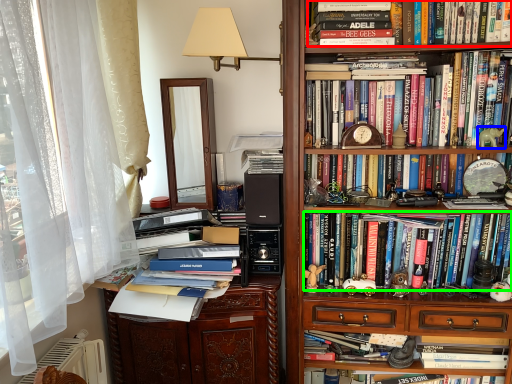
Question: Estimate the real-world distances between objects in this image. Which object is farther from book (highlighted by a red box), toy (highlighted by a blue box) or book (highlighted by a green box)?

Choices:
 (A) toy
 (B) book

Answer: (B)